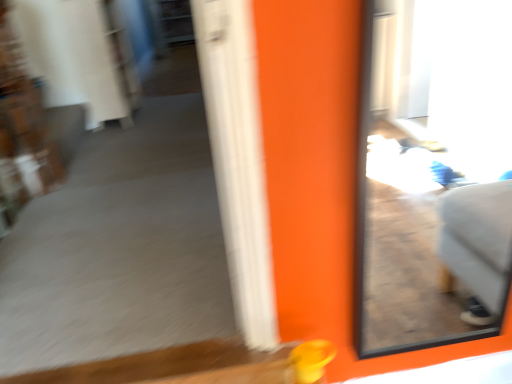
Question: Should I look upward or downward to see transparent glass window at upper right?

Choices:
 (A) down
 (B) up

Answer: (A)